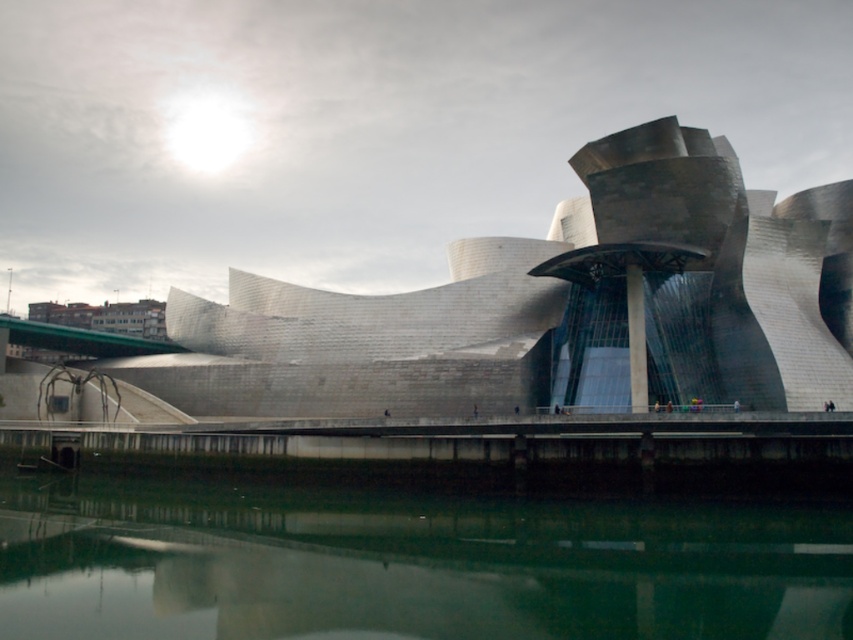
Is polished steel building at center positioned behind green reflective water at lower center?

Yes, it is.

Is polished steel building at center thinner than green reflective water at lower center?

No, polished steel building at center is not thinner than green reflective water at lower center.

At what (x,y) coordinates should I click in order to perform the action: click on polished steel building at center. Please return your answer as a coordinate pair (x, y). Looking at the image, I should click on (554, 307).

This screenshot has width=853, height=640. Find the location of `polished steel building at center`. polished steel building at center is located at coordinates (554, 307).